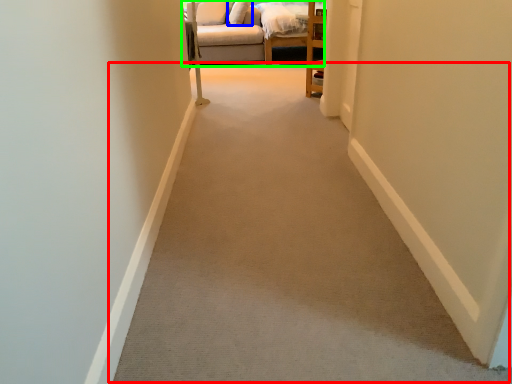
Question: Based on their relative distances, which object is nearer to path (highlighted by a red box)? Choose from pillow (highlighted by a blue box) and studio couch (highlighted by a green box).

Choices:
 (A) pillow
 (B) studio couch

Answer: (B)